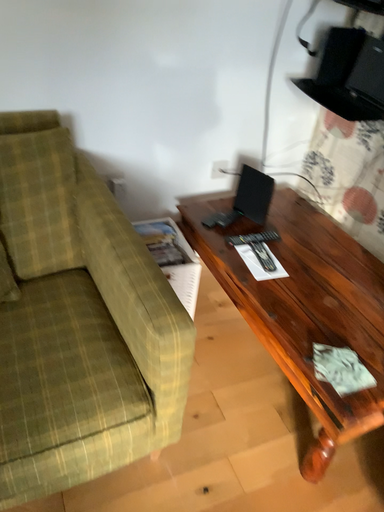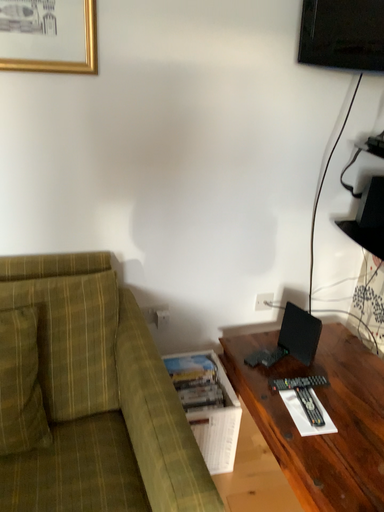
Question: Which way did the camera rotate in the video?

Choices:
 (A) rotated left
 (B) rotated right

Answer: (A)